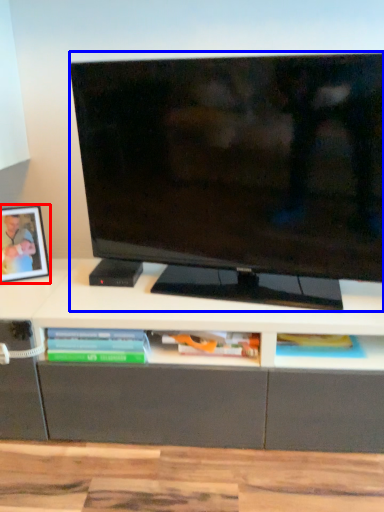
Question: Among these objects, which one is farthest to the camera, picture frame (highlighted by a red box) or television (highlighted by a blue box)?

Choices:
 (A) picture frame
 (B) television

Answer: (A)